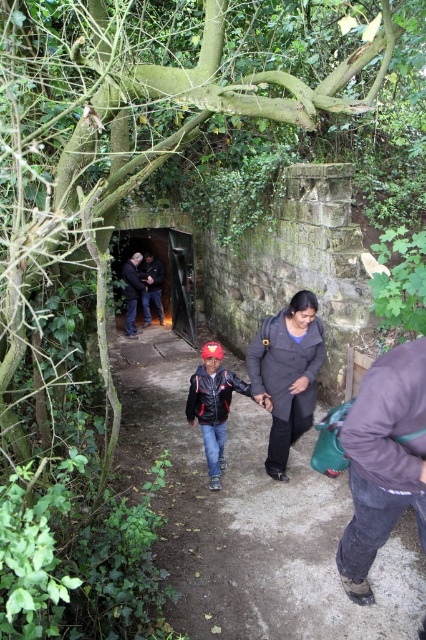
Can you confirm if dark brown fabric pants at lower right is thinner than dark stone tunnel at center?

Yes, dark brown fabric pants at lower right is thinner than dark stone tunnel at center.

Can you confirm if dark brown fabric pants at lower right is bigger than dark stone tunnel at center?

Actually, dark brown fabric pants at lower right might be smaller than dark stone tunnel at center.

Identify the location of dark brown fabric pants at lower right. (383, 460).

Locate an element on the screen. The width and height of the screenshot is (426, 640). dark brown fabric pants at lower right is located at coordinates (383, 460).

Can you confirm if dark gray jacket at center is thinner than dark blue jacket at center?

Answer: No, dark gray jacket at center is not thinner than dark blue jacket at center.

The height and width of the screenshot is (640, 426). What do you see at coordinates (132, 291) in the screenshot? I see `dark gray jacket at center` at bounding box center [132, 291].

Locate an element on the screen. This screenshot has width=426, height=640. dark gray jacket at center is located at coordinates (132, 291).

Identify the location of dark gray concrete path at center. The height and width of the screenshot is (640, 426). (252, 518).

Who is positioned more to the right, dark gray concrete path at center or dark stone tunnel at center?

Positioned to the right is dark gray concrete path at center.

Is point (313, 440) farther from viewer compared to point (161, 262)?

No.

This screenshot has width=426, height=640. Find the location of `dark gray concrete path at center`. dark gray concrete path at center is located at coordinates (252, 518).